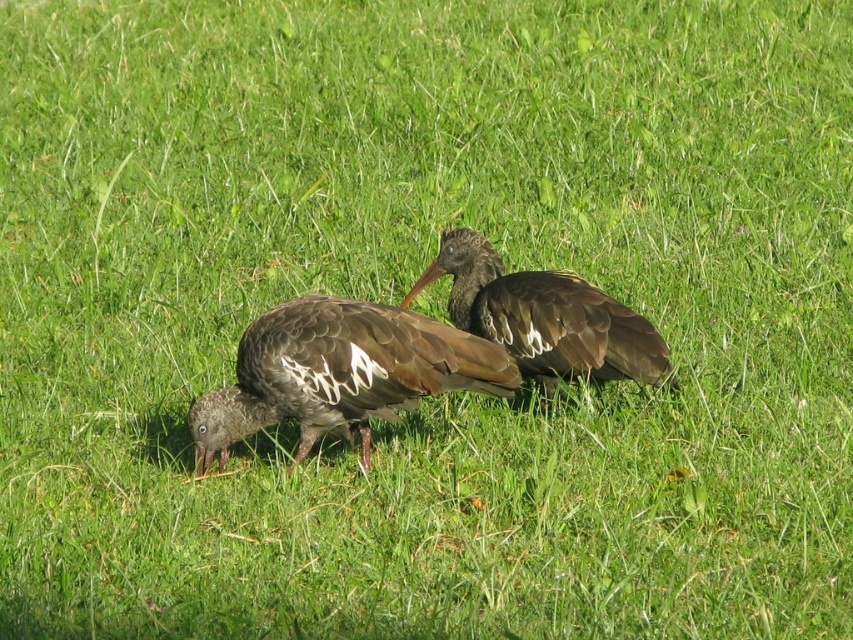
Does brown feathered bird at center appear on the right side of brown matte bird at center?

No, brown feathered bird at center is not to the right of brown matte bird at center.

Where is `brown feathered bird at center`? The image size is (853, 640). brown feathered bird at center is located at coordinates click(x=340, y=372).